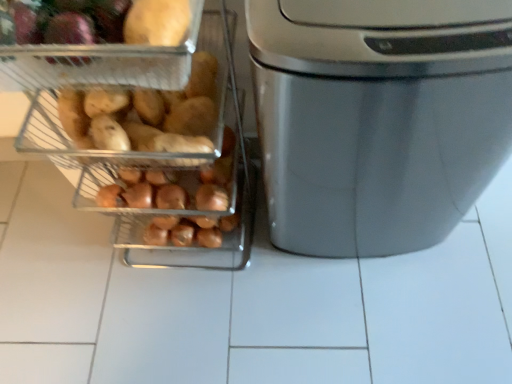
Identify the location of vacant area that lies in front of metallic silver trash can at right. This screenshot has width=512, height=384. (209, 326).